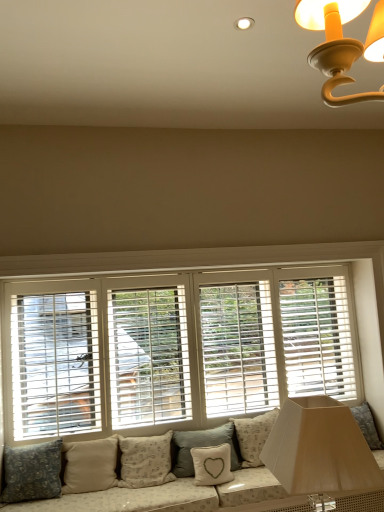
Question: From the image's perspective, is light gray textured pillow at center, placed as the fourth pillow when sorted from left to right, below white wood blinds at center?

Choices:
 (A) yes
 (B) no

Answer: (A)

Question: Is light gray textured pillow at center, arranged as the third pillow when viewed from the right, positioned with its back to white wood blinds at center?

Choices:
 (A) no
 (B) yes

Answer: (A)

Question: Can you confirm if light gray textured pillow at center, arranged as the third pillow when viewed from the right, is thinner than white wood blinds at center?

Choices:
 (A) yes
 (B) no

Answer: (B)

Question: Is light gray textured pillow at center, placed as the fourth pillow when sorted from left to right, positioned behind white wood blinds at center?

Choices:
 (A) yes
 (B) no

Answer: (A)

Question: From a real-world perspective, does light gray textured pillow at center, arranged as the third pillow when viewed from the right, stand above white wood blinds at center?

Choices:
 (A) no
 (B) yes

Answer: (A)

Question: Is light gray textured pillow at center, arranged as the third pillow when viewed from the right, placed right next to white wood blinds at center?

Choices:
 (A) yes
 (B) no

Answer: (B)

Question: Is fluffy white pillow at lower center, the first pillow viewed from the right, taller than beige fabric pillow at center, which ranks as the fourth pillow in right-to-left order?

Choices:
 (A) yes
 (B) no

Answer: (B)

Question: Considering the relative sizes of fluffy white pillow at lower center, the sixth pillow in the left-to-right sequence, and beige fabric pillow at center, positioned as the 3th pillow in left-to-right order, in the image provided, is fluffy white pillow at lower center, the sixth pillow in the left-to-right sequence, bigger than beige fabric pillow at center, positioned as the 3th pillow in left-to-right order,?

Choices:
 (A) yes
 (B) no

Answer: (B)

Question: Can you confirm if fluffy white pillow at lower center, the first pillow viewed from the right, is thinner than beige fabric pillow at center, positioned as the 3th pillow in left-to-right order?

Choices:
 (A) no
 (B) yes

Answer: (B)

Question: Does fluffy white pillow at lower center, the first pillow viewed from the right, come in front of beige fabric pillow at center, positioned as the 3th pillow in left-to-right order?

Choices:
 (A) no
 (B) yes

Answer: (A)

Question: Considering the relative positions of fluffy white pillow at lower center, the sixth pillow in the left-to-right sequence, and beige fabric pillow at center, positioned as the 3th pillow in left-to-right order, in the image provided, is fluffy white pillow at lower center, the sixth pillow in the left-to-right sequence, to the right of beige fabric pillow at center, positioned as the 3th pillow in left-to-right order, from the viewer's perspective?

Choices:
 (A) no
 (B) yes

Answer: (B)

Question: Is fluffy white pillow at lower center, the sixth pillow in the left-to-right sequence, looking in the opposite direction of beige fabric pillow at center, positioned as the 3th pillow in left-to-right order?

Choices:
 (A) no
 (B) yes

Answer: (A)

Question: Considering the relative positions of beige fabric pillow at center, positioned as the 3th pillow in left-to-right order, and white fabric pillow with heart design at lower center, the 5th pillow positioned from the left, in the image provided, is beige fabric pillow at center, positioned as the 3th pillow in left-to-right order, to the left of white fabric pillow with heart design at lower center, the 5th pillow positioned from the left, from the viewer's perspective?

Choices:
 (A) no
 (B) yes

Answer: (B)